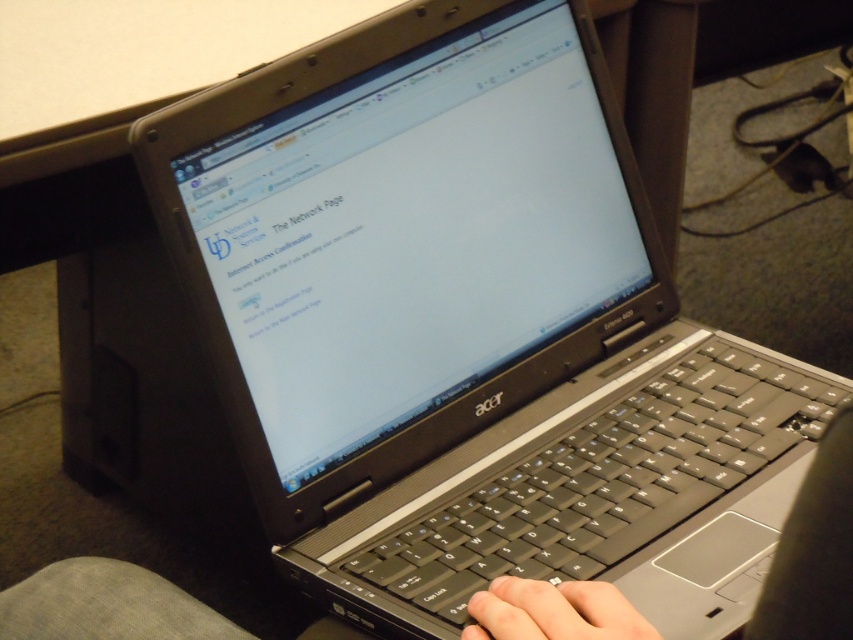
Consider the image. You are a delivery robot that needs to place a small package on the desk without touching any objects. The desk has a black matte keyboard at center and a skinny white hand at lower center. What is the minimum distance you should maintain between the package and the closest object?

The black matte keyboard at center and skinny white hand at lower center are 9.58 centimeters apart from each other. To ensure the package doesn not touch any objects, the minimum distance should be at least half of the smallest distance between them, which is 4.79 centimeters.

You are trying to type on the laptop but notice your hand is blocking the keyboard. Which object should you move to access the black matte keyboard at center without interfering with the skinny white hand at lower center?

You should move the skinny white hand at lower center to the right since the black matte keyboard at center is to the left of it, allowing you to access the keyboard without obstruction.